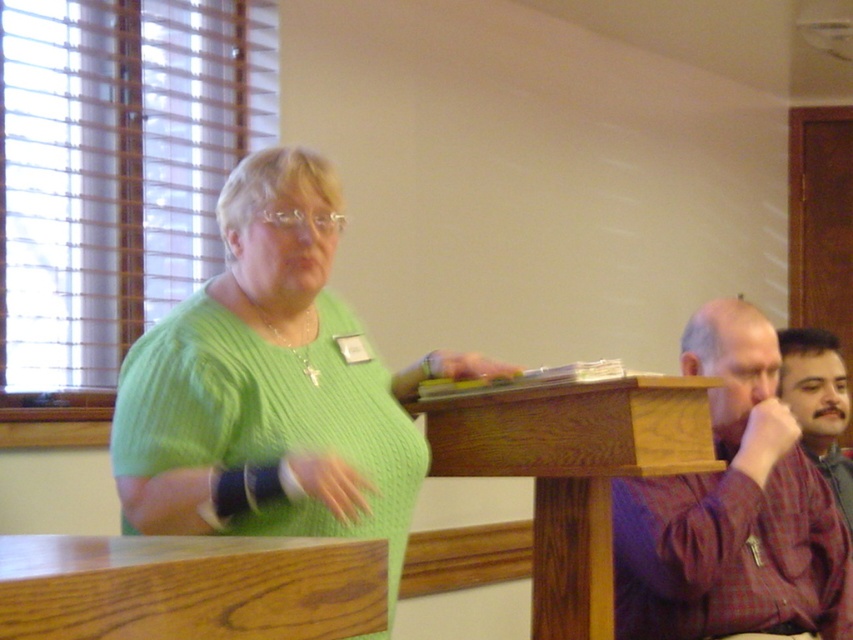
Question: Can you confirm if green knitted sweater at center is positioned to the right of plaid shirt at right?

Choices:
 (A) yes
 (B) no

Answer: (B)

Question: In this image, where is green knitted sweater at center located relative to brown plaid shirt at right?

Choices:
 (A) right
 (B) left

Answer: (B)

Question: Can you confirm if green knitted sweater at center is thinner than brown plaid shirt at right?

Choices:
 (A) yes
 (B) no

Answer: (B)

Question: Which point is closer to the camera?

Choices:
 (A) (718, 449)
 (B) (833, 403)
 (C) (531, 557)

Answer: (A)

Question: Which of the following is the farthest from the observer?

Choices:
 (A) green knitted sweater at center
 (B) plaid shirt at right
 (C) wooden podium at center

Answer: (B)

Question: Which point is closer to the camera?

Choices:
 (A) green knitted sweater at center
 (B) plaid shirt at right
 (C) brown plaid shirt at right
 (D) wooden podium at center

Answer: (A)